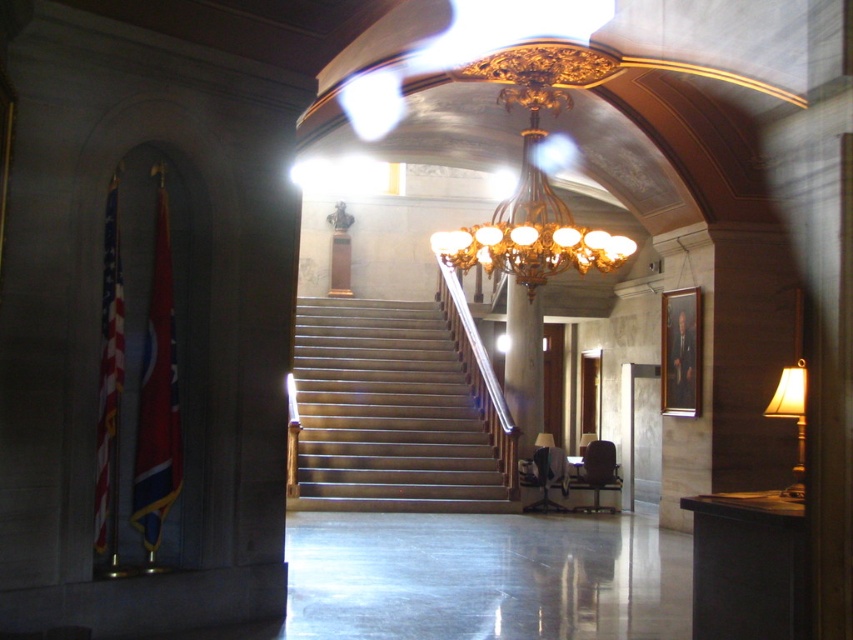
You are an architect inspecting the building layout. You need to determine if the polished wood stairs at center will be illuminated by the matte gold lampshade at right. Based on their positions, can you confirm this?

The polished wood stairs at center is positioned under the matte gold lampshade at right, so yes, the stairs will be illuminated by the lampshade.